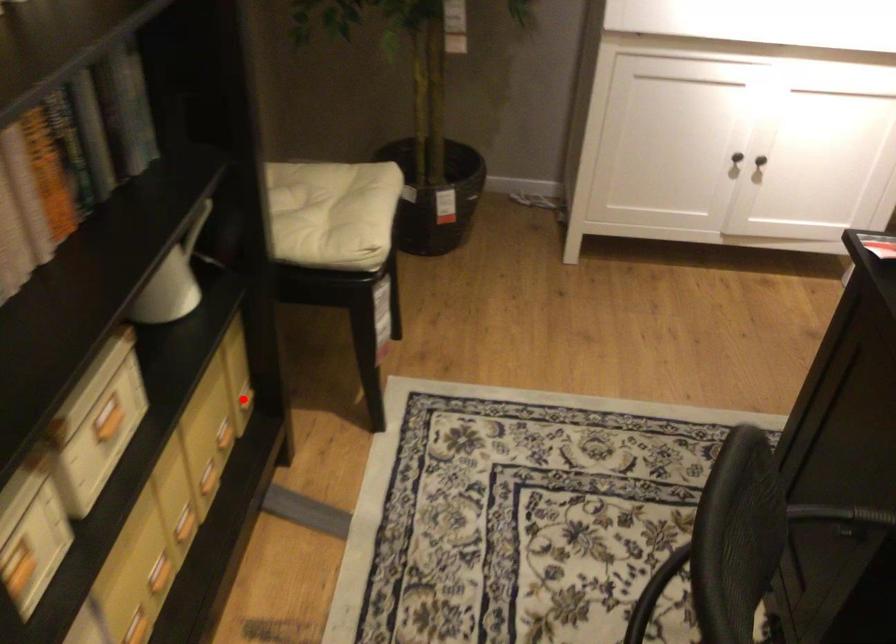
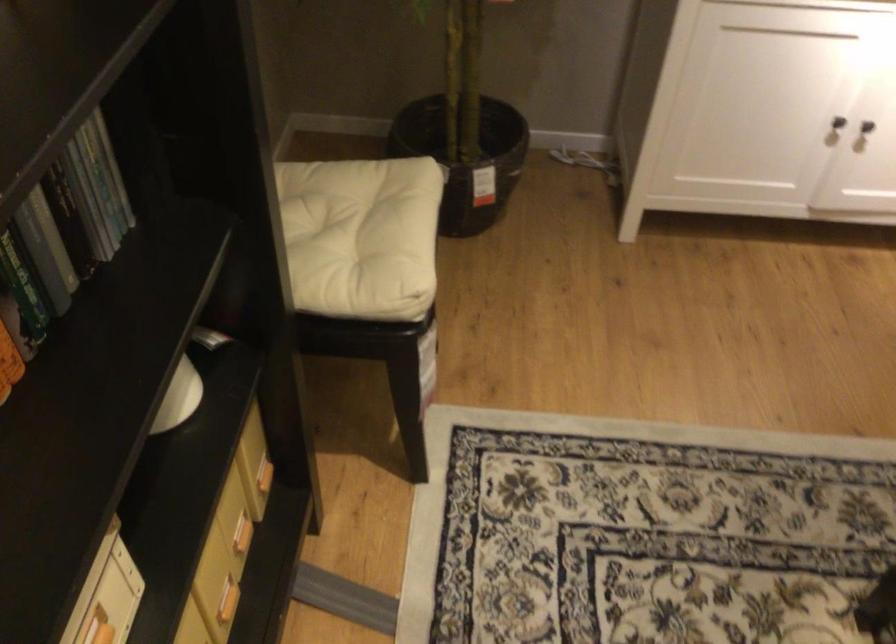
Question: I am providing you with two images of the same scene from different viewpoints. Image1 has a red point marked. In image2, the corresponding 3D location appears at what relative position? Reply with the corresponding letter.

Choices:
 (A) Closer
 (B) Farther

Answer: (A)